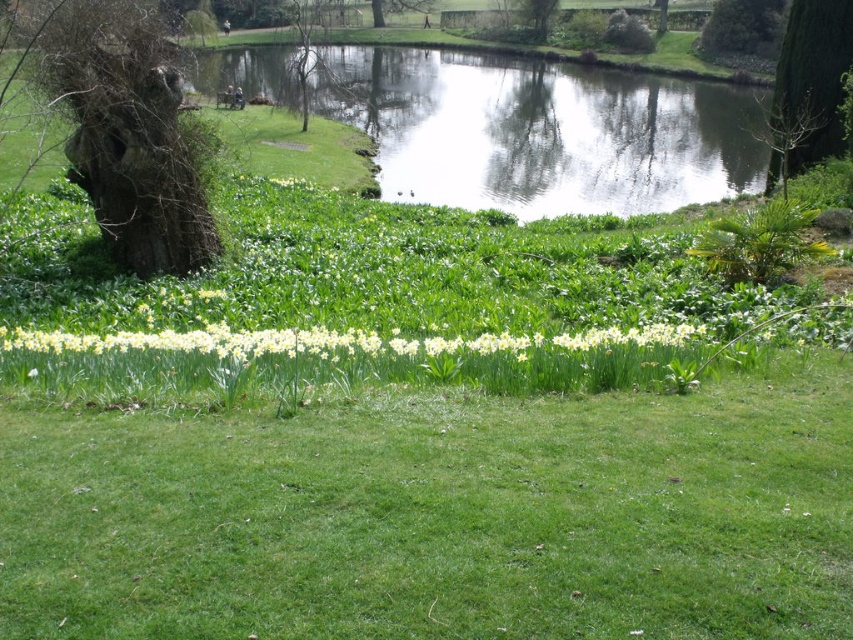
Question: Where is brown textured tree at left located in relation to green leafy tree at upper right in the image?

Choices:
 (A) below
 (B) above

Answer: (A)

Question: Which of the following is the closest to the observer?

Choices:
 (A) green leafy tree at upper center
 (B) green leafy tree at upper right
 (C) brown textured tree at left

Answer: (C)

Question: Is green textured tree at upper right closer to the viewer compared to green leafy tree at upper right?

Choices:
 (A) yes
 (B) no

Answer: (A)

Question: Is green leafy tree at upper right above green leafy tree at upper center?

Choices:
 (A) yes
 (B) no

Answer: (B)

Question: Among these objects, which one is farthest from the camera?

Choices:
 (A) green textured tree at upper right
 (B) brown textured tree at left
 (C) clear water at upper center

Answer: (C)

Question: Which of the following is the farthest from the observer?

Choices:
 (A) (544, 1)
 (B) (726, 148)
 (C) (726, 35)
 (D) (787, 100)

Answer: (A)